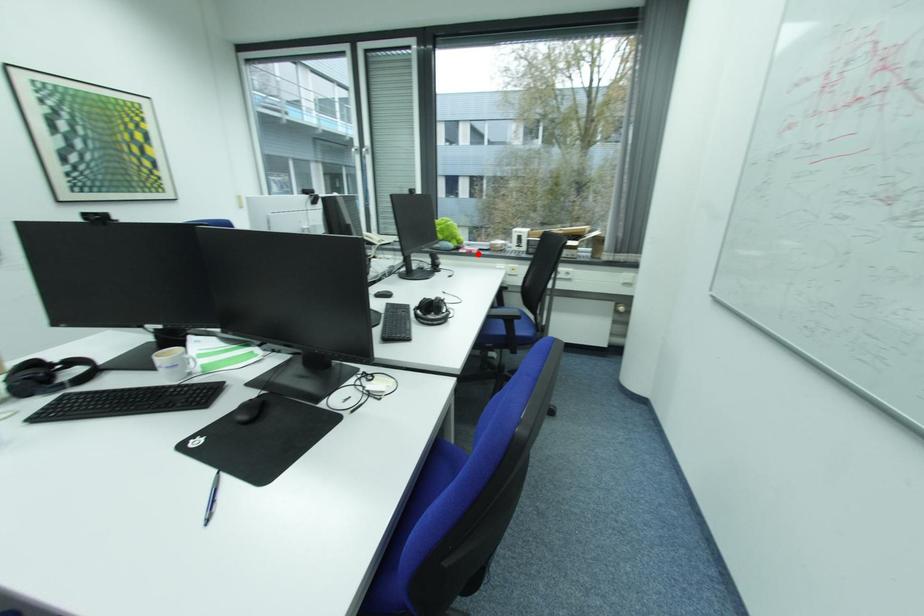
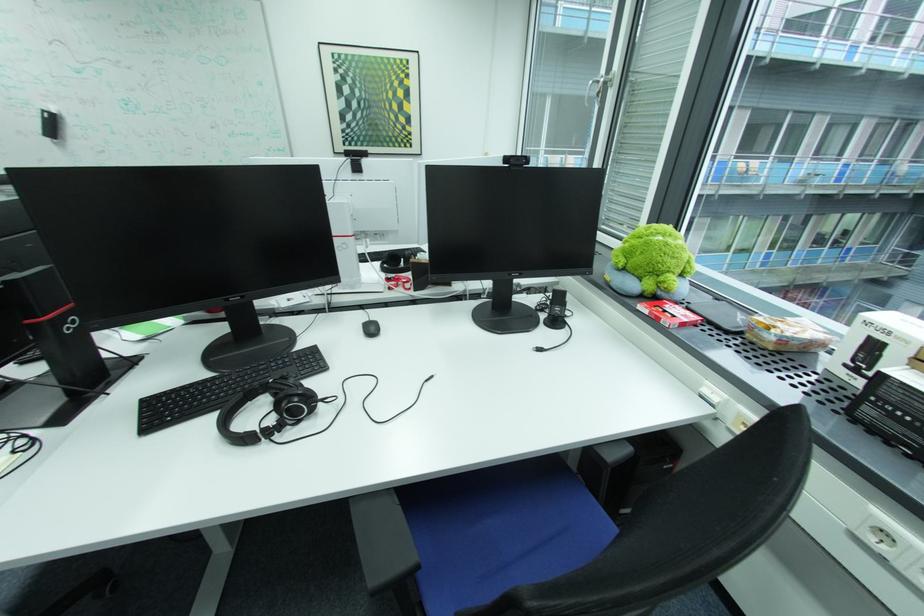
Locate, in the second image, the point that corresponds to the highlighted location in the first image.

(662, 322)